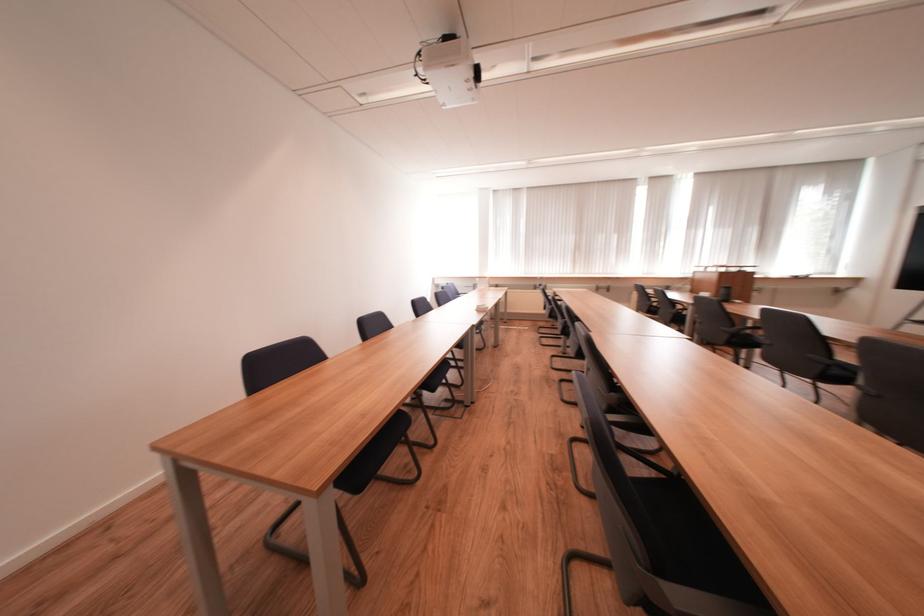
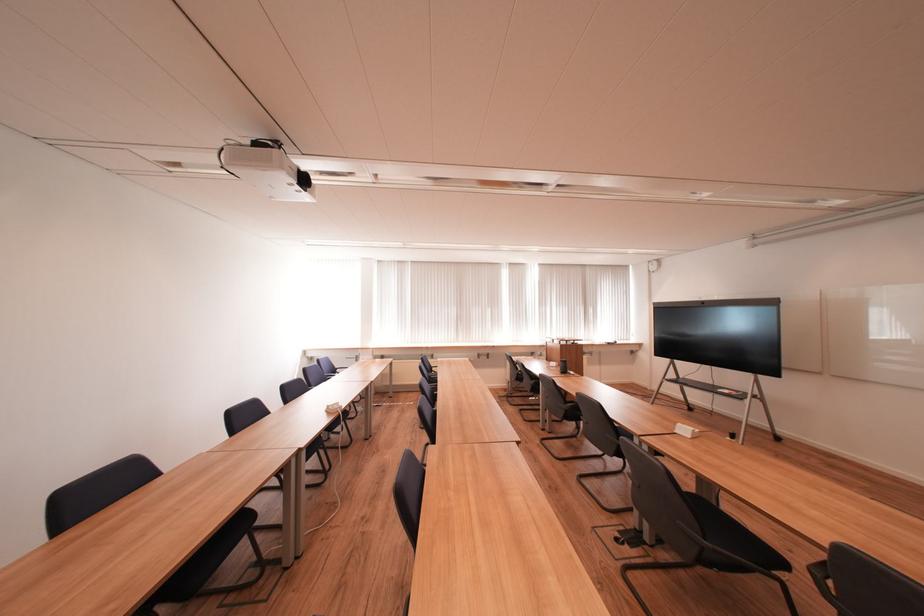
Question: The first image is from the beginning of the video and the second image is from the end. How did the camera likely rotate when shooting the video?

Choices:
 (A) Left
 (B) Right
 (C) Up
 (D) Down

Answer: (B)